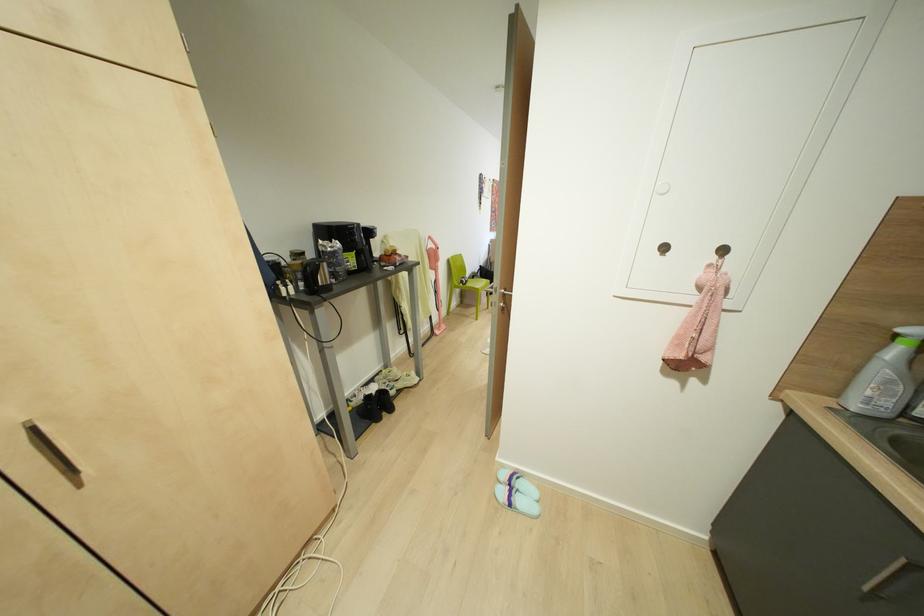
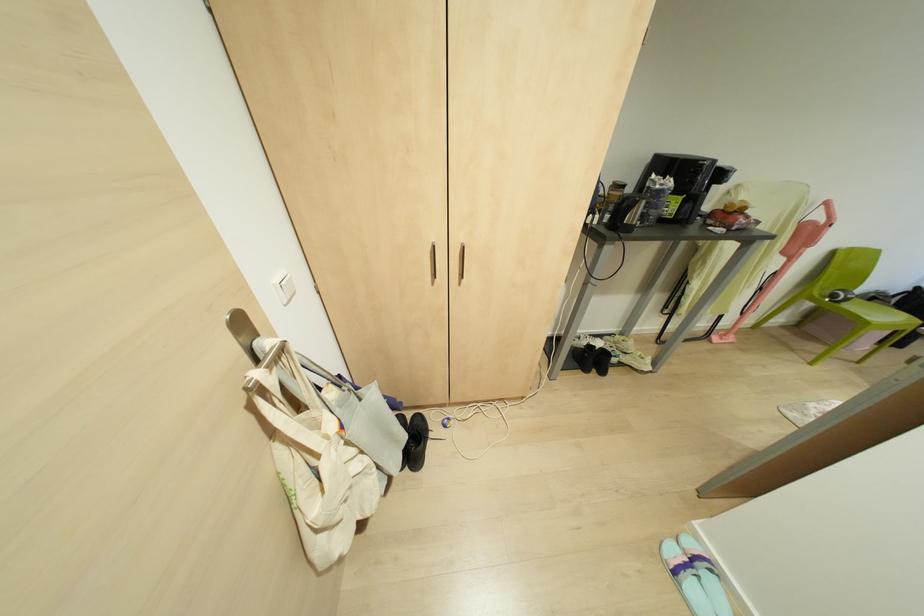
Find the pixel in the second image that matches [508,504] in the first image.

(675, 572)